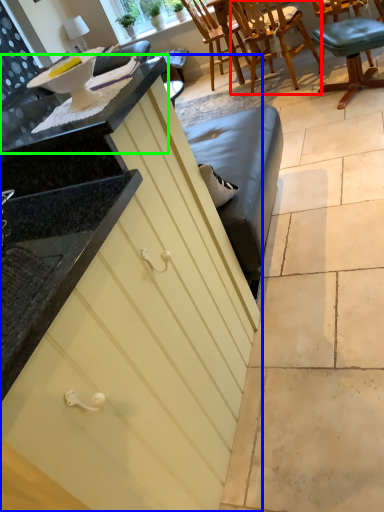
Question: Which object is positioned farthest from chair (highlighted by a red box)? Select from cabinetry (highlighted by a blue box) and countertop (highlighted by a green box).

Choices:
 (A) cabinetry
 (B) countertop

Answer: (A)